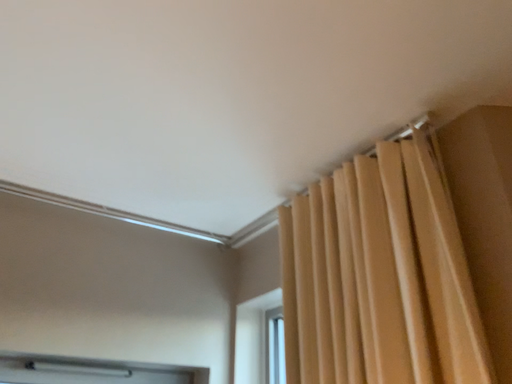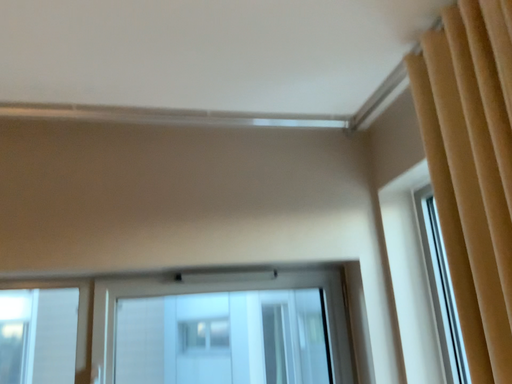
Question: How did the camera likely rotate when shooting the video?

Choices:
 (A) rotated downward
 (B) rotated upward

Answer: (A)